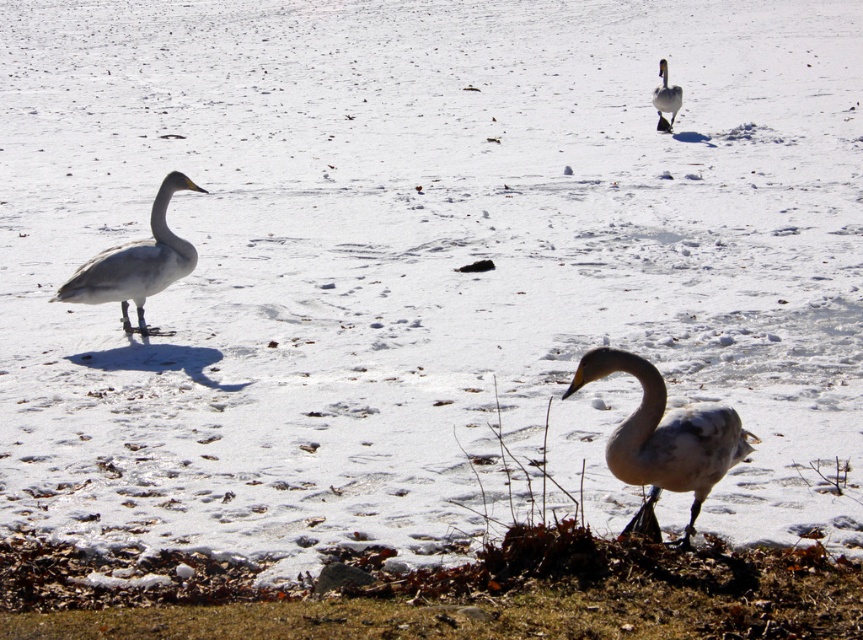
You are a wildlife photographer aiming to capture the white matte goose at lower center and the white matte duck at upper center in a single frame. Based on their sizes, which bird should you focus on first to ensure both are in focus?

The white matte goose at lower center is larger in size than the white matte duck at upper center, so focusing on the larger goose first will help ensure both are in focus as it requires adjusting the camera to accommodate the bigger subject first.

You are standing in the winter scene with two points marked on the ground. You want to place a small decoration closer to you. Which point should you choose between point (x=649, y=516) and point (x=669, y=106)?

Point (x=649, y=516) is closer to the viewer than point (x=669, y=106), so you should choose point (x=649, y=516) to place the decoration closer to you.

You are an ornithologist observing the two white matte geese in the winter scene. Which of the two geese, the white matte goose at lower center or the white matte goose at left, is positioned closer to the ground?

The white matte goose at lower center has a lesser height compared to the white matte goose at left, so it is positioned closer to the ground.